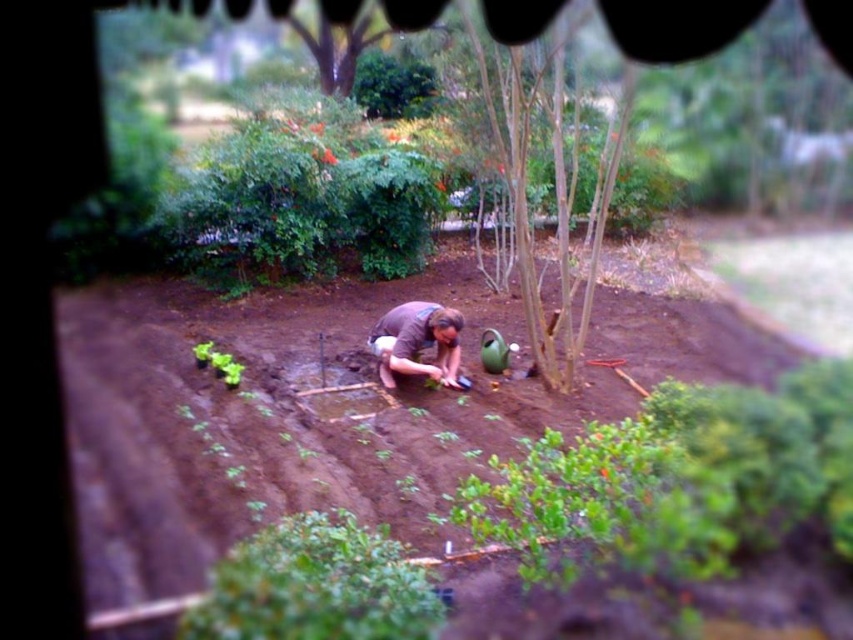
Can you confirm if brown bark tree at center is wider than brown cotton shirt at center?

Incorrect, brown bark tree at center's width does not surpass brown cotton shirt at center's.

Which is in front, point (554, 100) or point (453, 339)?

Positioned in front is point (554, 100).

At what (x,y) coordinates should I click in order to perform the action: click on brown bark tree at center. Please return your answer as a coordinate pair (x, y). Looking at the image, I should click on (552, 177).